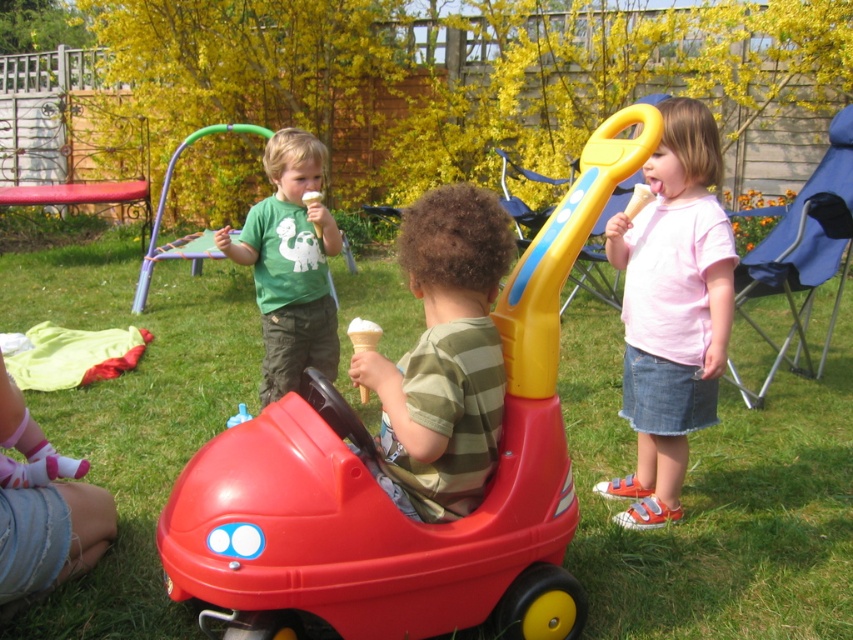
In the scene shown: Who is higher up, red plastic toy car at center or vanilla ice cream in waffle cone at center?

vanilla ice cream in waffle cone at center

Which is behind, point (270, 525) or point (379, 330)?

Point (379, 330)

Where is `red plastic toy car at center`? The width and height of the screenshot is (853, 640). red plastic toy car at center is located at coordinates (386, 497).

Is striped cotton shirt at center to the right of matte green t-shirt at upper center from the viewer's perspective?

Correct, you'll find striped cotton shirt at center to the right of matte green t-shirt at upper center.

Does point (463, 410) come in front of point (215, 237)?

Yes, it is in front of point (215, 237).

Between point (432, 310) and point (289, 172), which one is positioned behind?

Positioned behind is point (289, 172).

This screenshot has height=640, width=853. I want to click on striped cotton shirt at center, so click(444, 358).

Which is more to the left, matte green t-shirt at upper center or vanilla ice cream in waffle cone at center?

matte green t-shirt at upper center

Is point (265, 253) positioned in front of point (369, 323)?

No, (265, 253) is further to viewer.

Image resolution: width=853 pixels, height=640 pixels. What do you see at coordinates (289, 264) in the screenshot?
I see `matte green t-shirt at upper center` at bounding box center [289, 264].

This screenshot has width=853, height=640. Identify the location of matte green t-shirt at upper center. (289, 264).